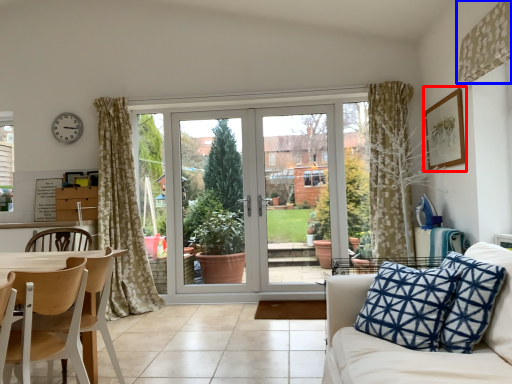
Question: Which object is closer to the camera taking this photo, picture frame (highlighted by a red box) or curtain (highlighted by a blue box)?

Choices:
 (A) picture frame
 (B) curtain

Answer: (B)